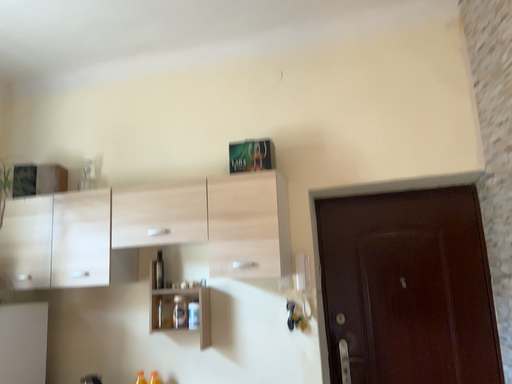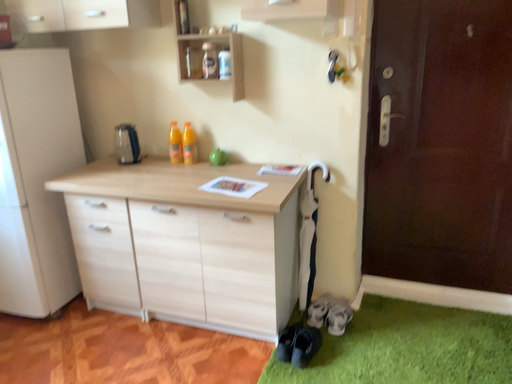
Question: How did the camera likely rotate when shooting the video?

Choices:
 (A) rotated upward
 (B) rotated downward

Answer: (B)